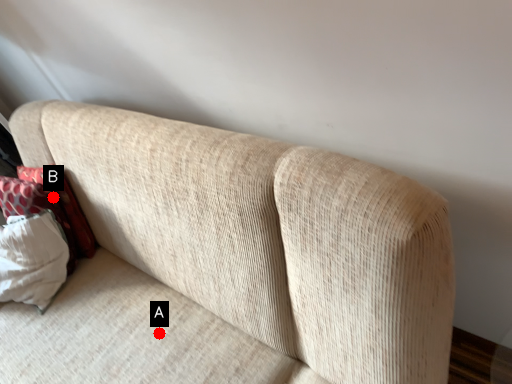
Question: Two points are circled on the image, labeled by A and B beside each circle. Which point is farther to the camera?

Choices:
 (A) A is further
 (B) B is further

Answer: (B)